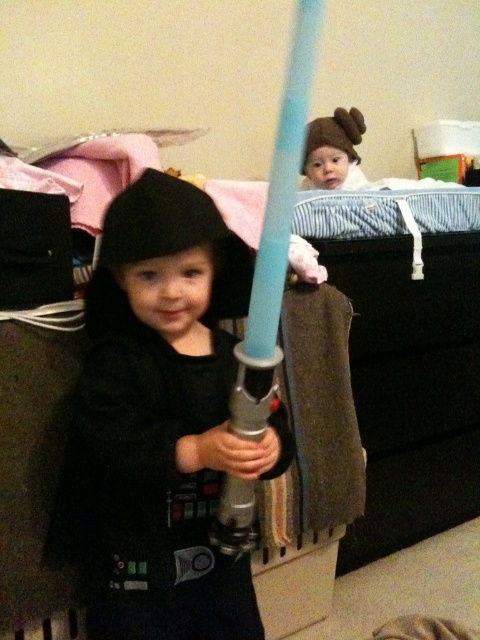
Question: Which of the following is the closest to the observer?

Choices:
 (A) matte black costume at center
 (B) light blue plastic sword at center

Answer: (B)

Question: Is matte black costume at center wider than light blue plastic sword at center?

Choices:
 (A) yes
 (B) no

Answer: (A)

Question: Does matte black costume at center lie behind light blue plastic sword at center?

Choices:
 (A) yes
 (B) no

Answer: (A)

Question: Where is matte black costume at center located in relation to light blue plastic sword at center in the image?

Choices:
 (A) above
 (B) below

Answer: (B)

Question: Which point appears closest to the camera in this image?

Choices:
 (A) (201, 195)
 (B) (303, 81)

Answer: (B)